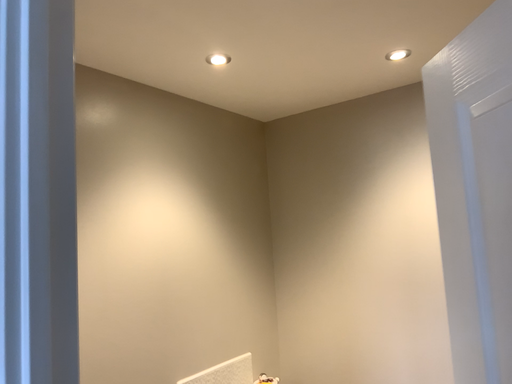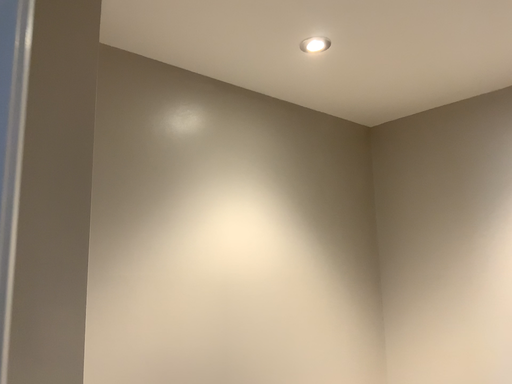
Question: Which way did the camera rotate in the video?

Choices:
 (A) rotated left
 (B) rotated right

Answer: (A)